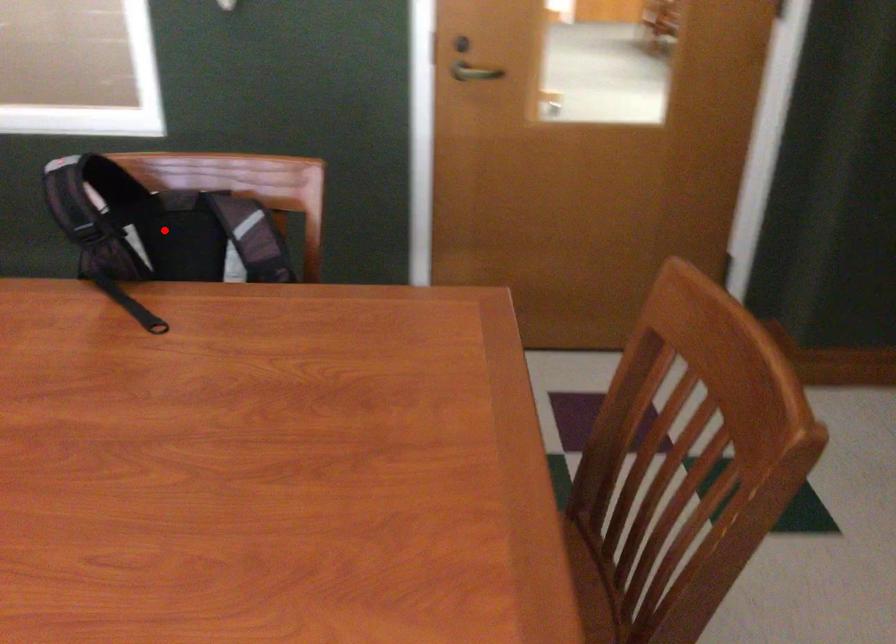
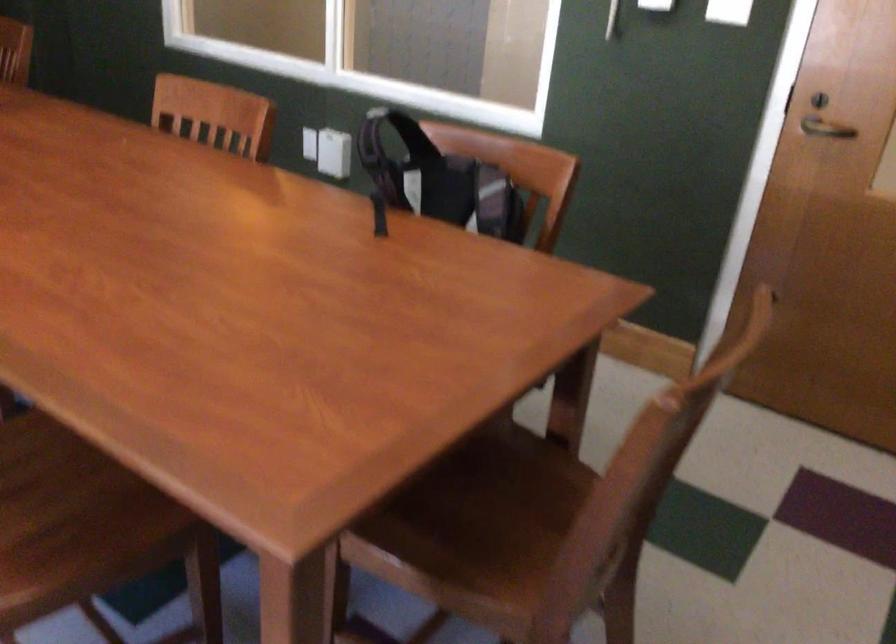
Question: I am providing you with two images of the same scene from different viewpoints. Given a red point in image1, look at the same physical point in image2. Is it:

Choices:
 (A) Closer to the viewpoint
 (B) Farther from the viewpoint

Answer: (B)